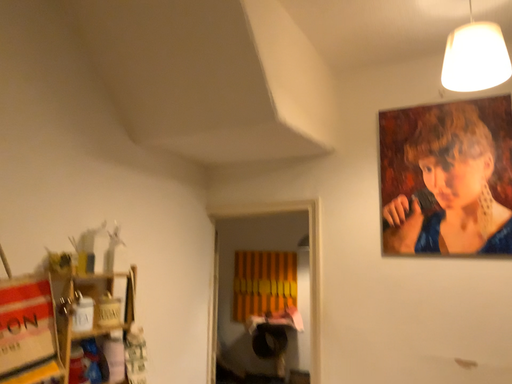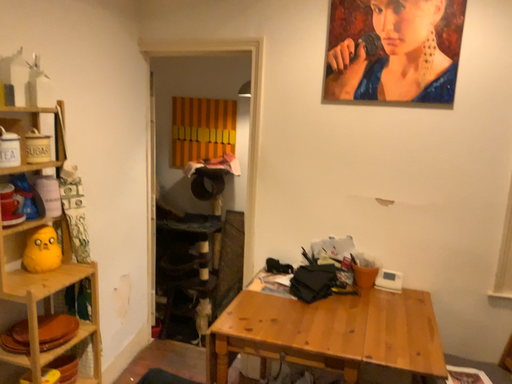
Question: How did the camera likely rotate when shooting the video?

Choices:
 (A) rotated left
 (B) rotated right

Answer: (B)